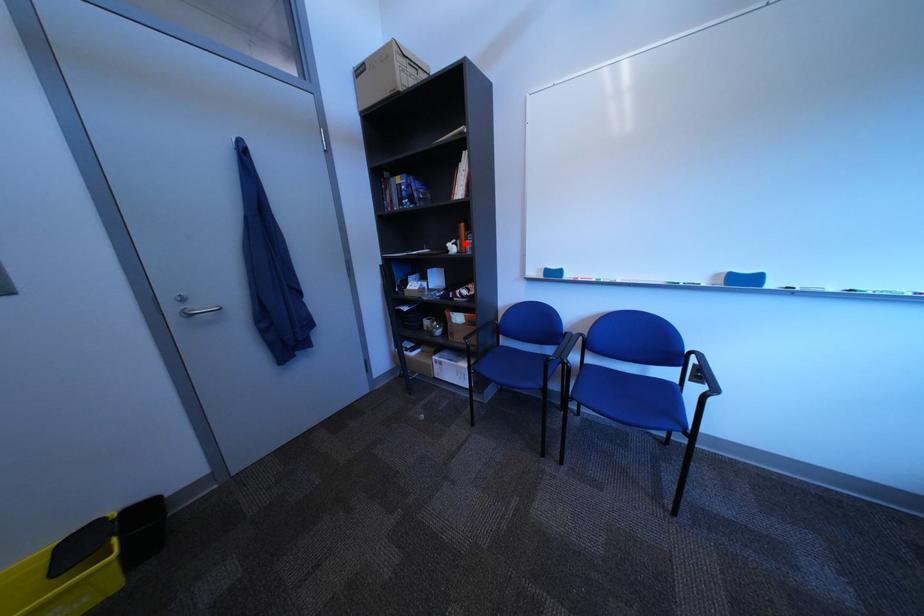
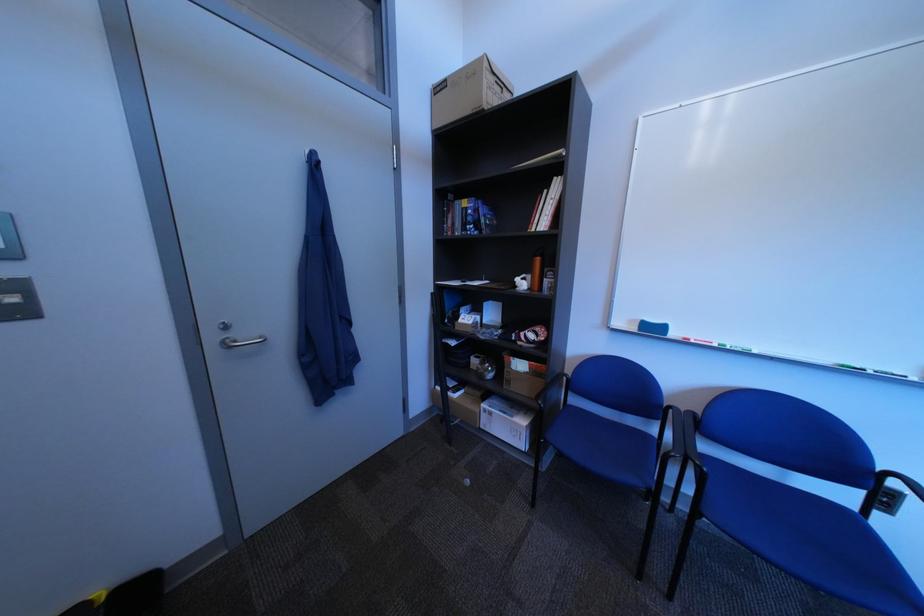
Where in the second image is the point corresponding to the highlighted location from the first image?

(535, 278)